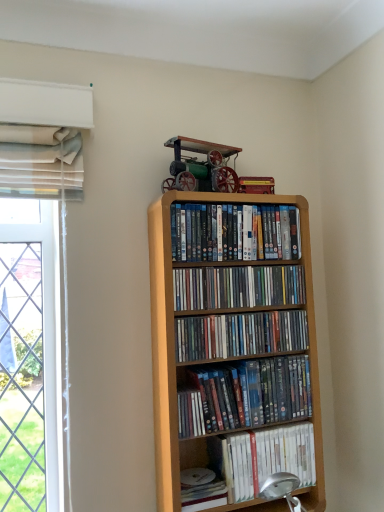
Find the location of a particular element. This screenshot has width=384, height=512. matte plastic dvds at upper center, which is the 5th book in bottom-to-top order is located at coordinates (234, 232).

What do you see at coordinates (245, 396) in the screenshot?
I see `matte plastic dvds at center, placed as the fourth book when sorted from top to bottom` at bounding box center [245, 396].

Locate an element on the screen. This screenshot has height=512, width=384. matte plastic dvds at center, the 3th book when ordered from top to bottom is located at coordinates (240, 335).

Is the surface of matte plastic dvds at upper center, the first book viewed from the top, in direct contact with light wood bookcase at center?

matte plastic dvds at upper center, the first book viewed from the top, is not next to light wood bookcase at center, and they're not touching.

Is matte plastic dvds at upper center, which is the 5th book in bottom-to-top order, aimed at light wood bookcase at center?

Yes, matte plastic dvds at upper center, which is the 5th book in bottom-to-top order, is facing light wood bookcase at center.

Is matte plastic dvds at upper center, the first book viewed from the top, taller than light wood bookcase at center?

No, matte plastic dvds at upper center, the first book viewed from the top, is not taller than light wood bookcase at center.

From a real-world perspective, does white matte paperback book at lower center stand above matte plastic dvds at upper center, the first book viewed from the top?

Actually, white matte paperback book at lower center is physically below matte plastic dvds at upper center, the first book viewed from the top, in the real world.

Considering the sizes of objects white matte paperback book at lower center and matte plastic dvds at upper center, the first book viewed from the top, in the image provided, who is smaller, white matte paperback book at lower center or matte plastic dvds at upper center, the first book viewed from the top,?

white matte paperback book at lower center is smaller.

Which of these two, white matte paperback book at lower center or matte plastic dvds at upper center, which is the 5th book in bottom-to-top order, is thinner?

With smaller width is white matte paperback book at lower center.

Would you say white matte paperback book at lower center is a long distance from matte plastic dvds at upper center, the first book viewed from the top?

No, white matte paperback book at lower center is not far from matte plastic dvds at upper center, the first book viewed from the top.

From a real-world perspective, which is physically above, matte plastic dvds at center, placed as the 2th book when sorted from top to bottom, or white matte paperback book at lower center?

matte plastic dvds at center, placed as the 2th book when sorted from top to bottom.

Looking at the image, does matte plastic dvds at center, placed as the 2th book when sorted from top to bottom, seem bigger or smaller compared to white matte paperback book at lower center?

In the image, matte plastic dvds at center, placed as the 2th book when sorted from top to bottom, appears to be larger than white matte paperback book at lower center.

From the image's perspective, would you say matte plastic dvds at center, the fourth book ordered from the bottom, is positioned over white matte paperback book at lower center?

Correct, matte plastic dvds at center, the fourth book ordered from the bottom, appears higher than white matte paperback book at lower center in the image.

Between white matte book at lower right, marked as the 1th book in a bottom-to-top arrangement, and light wood bookcase at center, which one is positioned behind?

white matte book at lower right, marked as the 1th book in a bottom-to-top arrangement, is further from the camera.

Is there a large distance between white matte book at lower right, marked as the 1th book in a bottom-to-top arrangement, and light wood bookcase at center?

white matte book at lower right, marked as the 1th book in a bottom-to-top arrangement, is near light wood bookcase at center, not far away.

How many degrees apart are the facing directions of white matte book at lower right, the 5th book in the top-to-bottom sequence, and light wood bookcase at center?

0.318 degrees.

There is a light wood bookcase at center. Where is `the 2nd book below it (from the image's perspective)`? This screenshot has width=384, height=512. the 2nd book below it (from the image's perspective) is located at coordinates (266, 458).

Considering the points (291, 279) and (251, 387), which point is behind, point (291, 279) or point (251, 387)?

The point (291, 279) is behind.

Who is bigger, matte plastic dvds at center, placed as the 2th book when sorted from top to bottom, or matte plastic dvds at center, positioned as the 2th book in bottom-to-top order?

matte plastic dvds at center, positioned as the 2th book in bottom-to-top order.

Based on the photo, from the image's perspective, would you say matte plastic dvds at center, the fourth book ordered from the bottom, is shown under matte plastic dvds at center, placed as the fourth book when sorted from top to bottom?

No, from the image's perspective, matte plastic dvds at center, the fourth book ordered from the bottom, is not beneath matte plastic dvds at center, placed as the fourth book when sorted from top to bottom.

Where is `the 2nd book counting from the left side of the matte plastic dvds at center, placed as the fourth book when sorted from top to bottom`? Image resolution: width=384 pixels, height=512 pixels. the 2nd book counting from the left side of the matte plastic dvds at center, placed as the fourth book when sorted from top to bottom is located at coordinates (237, 287).

How many degrees apart are the facing directions of white matte paperback book at lower center and light wood bookcase at center?

The angle between the facing direction of white matte paperback book at lower center and the facing direction of light wood bookcase at center is 0.318 degrees.

Is white matte paperback book at lower center placed right next to light wood bookcase at center?

No.

Is white matte paperback book at lower center behind light wood bookcase at center?

Yes.

Considering the sizes of objects white matte paperback book at lower center and light wood bookcase at center in the image provided, who is thinner, white matte paperback book at lower center or light wood bookcase at center?

With smaller width is white matte paperback book at lower center.

Is light wood bookcase at center turned away from matte plastic dvds at center, placed as the 2th book when sorted from top to bottom?

Correct, light wood bookcase at center is looking away from matte plastic dvds at center, placed as the 2th book when sorted from top to bottom.

Between light wood bookcase at center and matte plastic dvds at center, placed as the 2th book when sorted from top to bottom, which one has larger width?

With larger width is light wood bookcase at center.

Is matte plastic dvds at center, the fourth book ordered from the bottom, completely or partially inside light wood bookcase at center?

Yes, matte plastic dvds at center, the fourth book ordered from the bottom, is a part of light wood bookcase at center.

From a real-world perspective, is light wood bookcase at center under matte plastic dvds at center, placed as the 2th book when sorted from top to bottom?

Yes.

This screenshot has height=512, width=384. Find the location of `the 3rd book located above the light wood bookcase at center (from a real-world perspective)`. the 3rd book located above the light wood bookcase at center (from a real-world perspective) is located at coordinates (234, 232).

I want to click on the 5th book above the white matte paperback book at lower center (from the image's perspective), so click(234, 232).

Looking at this image, which object lies further to the anchor point matte plastic dvds at center, placed as the fourth book when sorted from top to bottom, matte plastic dvds at center, the 3th book when ordered from top to bottom, or matte plastic dvds at upper center, which is the 5th book in bottom-to-top order?

matte plastic dvds at upper center, which is the 5th book in bottom-to-top order, is further to matte plastic dvds at center, placed as the fourth book when sorted from top to bottom.

From the image, which object appears to be farther from matte plastic dvds at center, placed as the 2th book when sorted from top to bottom, white matte paperback book at lower center or matte plastic dvds at upper center, which is the 5th book in bottom-to-top order?

white matte paperback book at lower center is positioned further to the anchor matte plastic dvds at center, placed as the 2th book when sorted from top to bottom.

Estimate the real-world distances between objects in this image. Which object is closer to matte plastic dvds at upper center, which is the 5th book in bottom-to-top order, matte plastic dvds at center, the 3th book when ordered from top to bottom, or white matte book at lower right, the 5th book in the top-to-bottom sequence?

The object closer to matte plastic dvds at upper center, which is the 5th book in bottom-to-top order, is matte plastic dvds at center, the 3th book when ordered from top to bottom.

From the image, which object appears to be nearer to white matte paperback book at lower center, matte plastic dvds at center, placed as the fourth book when sorted from top to bottom, or white matte book at lower right, marked as the 1th book in a bottom-to-top arrangement?

The object closer to white matte paperback book at lower center is white matte book at lower right, marked as the 1th book in a bottom-to-top arrangement.

Considering their positions, is white matte book at lower right, marked as the 1th book in a bottom-to-top arrangement, positioned further to matte plastic dvds at center, positioned as the 2th book in bottom-to-top order, than light wood bookcase at center?

The object further to matte plastic dvds at center, positioned as the 2th book in bottom-to-top order, is white matte book at lower right, marked as the 1th book in a bottom-to-top arrangement.

Based on their spatial positions, is matte plastic dvds at upper center, the first book viewed from the top, or white matte book at lower right, marked as the 1th book in a bottom-to-top arrangement, further from matte plastic dvds at center, positioned as the 2th book in bottom-to-top order?

Among the two, matte plastic dvds at upper center, the first book viewed from the top, is located further to matte plastic dvds at center, positioned as the 2th book in bottom-to-top order.

Considering their positions, is matte plastic dvds at center, placed as the fourth book when sorted from top to bottom, positioned further to matte plastic dvds at upper center, which is the 5th book in bottom-to-top order, than white matte book at lower right, marked as the 1th book in a bottom-to-top arrangement?

Based on the image, white matte book at lower right, marked as the 1th book in a bottom-to-top arrangement, appears to be further to matte plastic dvds at upper center, which is the 5th book in bottom-to-top order.

From the image, which object appears to be nearer to matte plastic dvds at center, the 3th book positioned from the bottom, white matte paperback book at lower center or matte plastic dvds at center, placed as the 2th book when sorted from top to bottom?

matte plastic dvds at center, placed as the 2th book when sorted from top to bottom, lies closer to matte plastic dvds at center, the 3th book positioned from the bottom, than the other object.

Where is `book between matte plastic dvds at center, placed as the 2th book when sorted from top to bottom, and light wood bookcase at center in the up-down direction`? The height and width of the screenshot is (512, 384). book between matte plastic dvds at center, placed as the 2th book when sorted from top to bottom, and light wood bookcase at center in the up-down direction is located at coordinates (240, 335).

This screenshot has width=384, height=512. In order to click on book between matte plastic dvds at center, the fourth book ordered from the bottom, and matte plastic dvds at center, placed as the fourth book when sorted from top to bottom, in the vertical direction in this screenshot , I will do `click(240, 335)`.

This screenshot has height=512, width=384. What are the coordinates of `book between matte plastic dvds at center, the 3th book positioned from the bottom, and white matte book at lower right, the 5th book in the top-to-bottom sequence, in the up-down direction` in the screenshot? It's located at (245, 396).

Find the location of a particular element. This screenshot has width=384, height=512. book between matte plastic dvds at center, positioned as the 2th book in bottom-to-top order, and white matte paperback book at lower center from top to bottom is located at coordinates (266, 458).